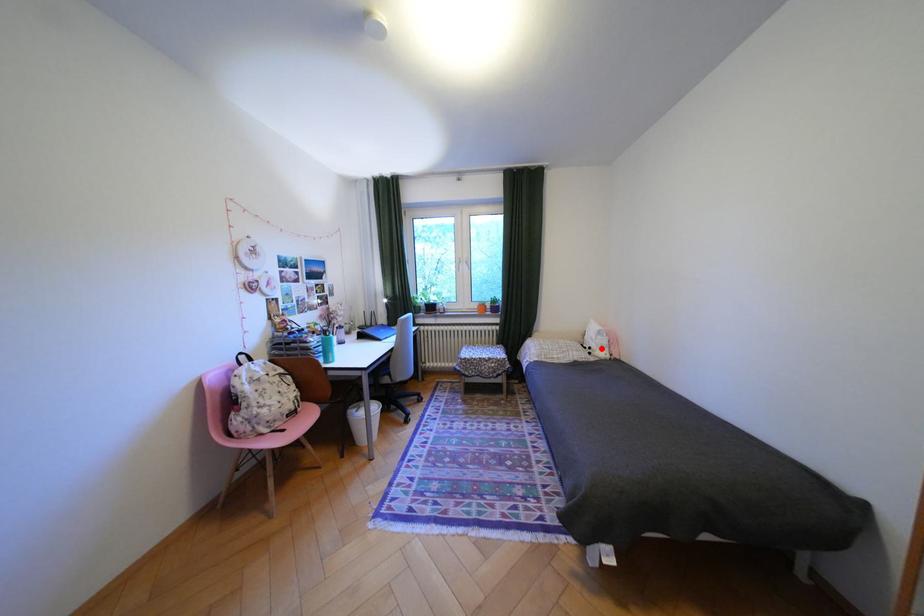
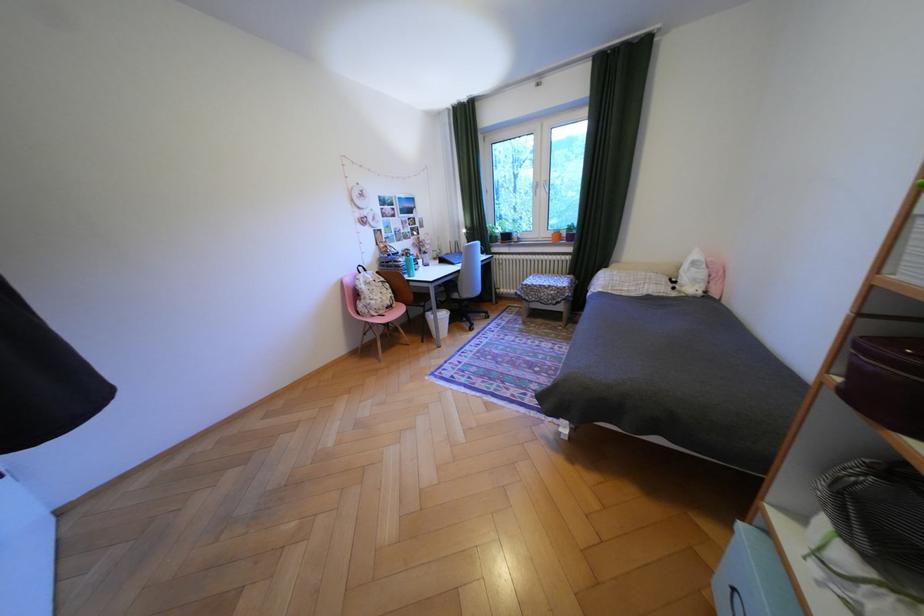
Find the pixel in the second image that matches the highlighted location in the first image.

(687, 282)